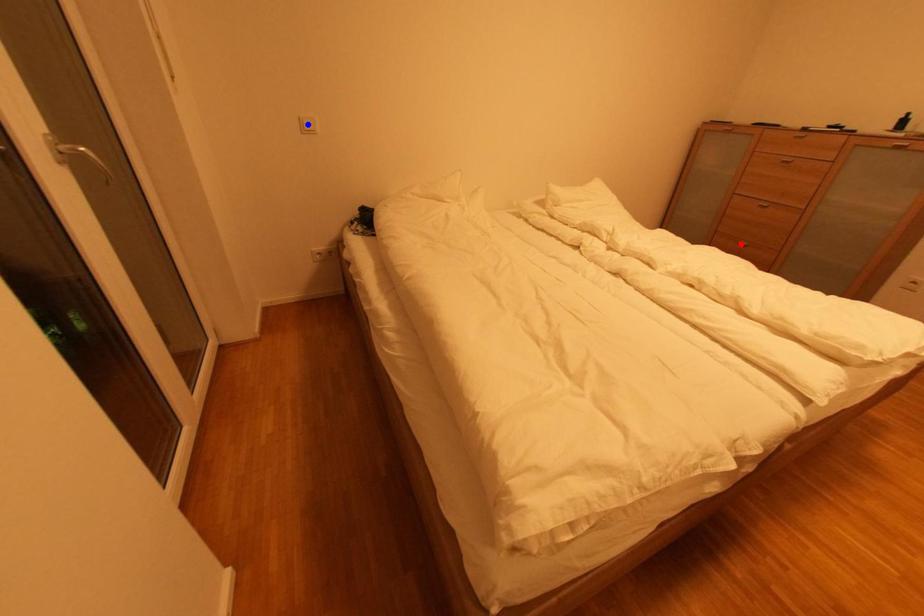
Question: In the image, two points are highlighted. Which point is nearer to the camera? Reply with the corresponding letter.

Choices:
 (A) blue point
 (B) red point

Answer: (A)